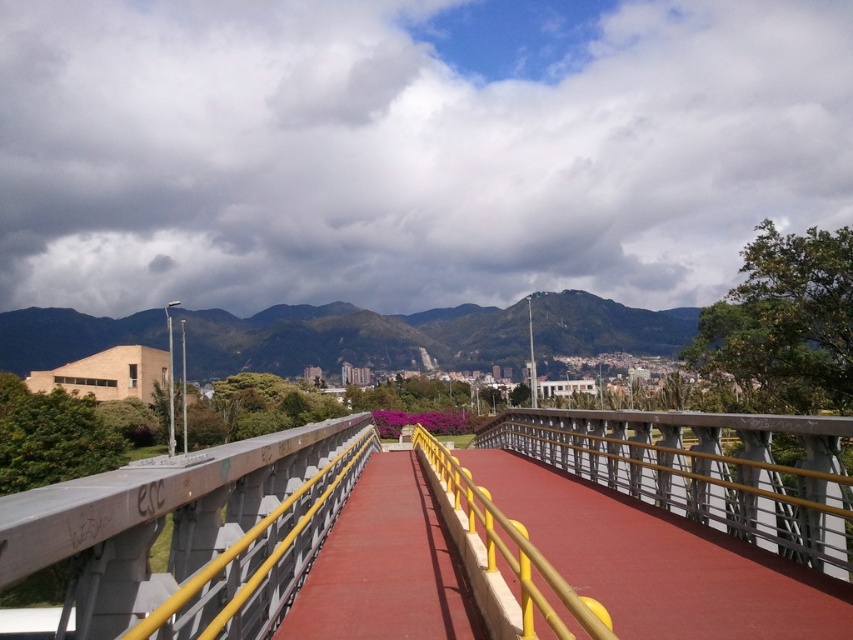
Question: Among these points, which one is farthest from the camera?

Choices:
 (A) (474, 602)
 (B) (184, 570)

Answer: (A)

Question: Does concrete bridge at center appear on the right side of red rubber path at center?

Choices:
 (A) no
 (B) yes

Answer: (A)

Question: Which object is farther from the camera taking this photo?

Choices:
 (A) concrete bridge at center
 (B) red rubber path at center

Answer: (B)

Question: Is concrete bridge at center in front of red rubber path at center?

Choices:
 (A) no
 (B) yes

Answer: (B)

Question: Observing the image, what is the correct spatial positioning of concrete bridge at center in reference to red rubber path at center?

Choices:
 (A) below
 (B) above

Answer: (A)

Question: Which point is closer to the camera?

Choices:
 (A) (444, 557)
 (B) (64, 618)

Answer: (B)